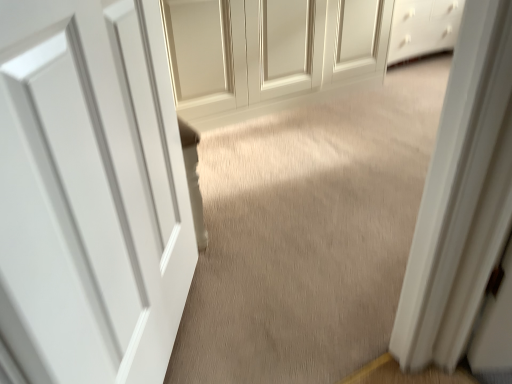
Question: Should I look upward or downward to see beige carpet at center?

Choices:
 (A) up
 (B) down

Answer: (A)

Question: From a real-world perspective, is white smooth door at center, acting as the 2th door starting from the right, below matte white door at center, the 1th door positioned from the top?

Choices:
 (A) yes
 (B) no

Answer: (B)

Question: Could you tell me if white smooth door at center, acting as the 1th door starting from the left, is turned towards matte white door at center, positioned as the 2th door in bottom-to-top order?

Choices:
 (A) yes
 (B) no

Answer: (B)

Question: Is white smooth door at center, which is the 1th door in front-to-back order, to the right of matte white door at center, positioned as the 2th door in bottom-to-top order, from the viewer's perspective?

Choices:
 (A) no
 (B) yes

Answer: (A)

Question: Does white smooth door at center, acting as the 1th door starting from the left, contain matte white door at center, which is the 2th door in left-to-right order?

Choices:
 (A) yes
 (B) no

Answer: (B)

Question: Is white smooth door at center, which appears as the second door when viewed from the top, directly adjacent to matte white door at center, which is counted as the 1th door, starting from the right?

Choices:
 (A) yes
 (B) no

Answer: (B)

Question: Considering the relative sizes of white smooth door at center, acting as the 2th door starting from the right, and matte white door at center, positioned as the 2th door in bottom-to-top order, in the image provided, is white smooth door at center, acting as the 2th door starting from the right, wider than matte white door at center, positioned as the 2th door in bottom-to-top order,?

Choices:
 (A) no
 (B) yes

Answer: (A)

Question: Considering the relative positions of matte white door at center, the second door viewed from the front, and white smooth door at center, acting as the 2th door starting from the right, in the image provided, is matte white door at center, the second door viewed from the front, to the left of white smooth door at center, acting as the 2th door starting from the right, from the viewer's perspective?

Choices:
 (A) yes
 (B) no

Answer: (B)

Question: From the image's perspective, is matte white door at center, which is the 2th door in left-to-right order, above white smooth door at center, which appears as the second door when viewed from the top?

Choices:
 (A) yes
 (B) no

Answer: (A)

Question: Can you confirm if matte white door at center, which is the 2th door in left-to-right order, is positioned to the right of white smooth door at center, acting as the 2th door starting from the right?

Choices:
 (A) yes
 (B) no

Answer: (A)

Question: Is the surface of matte white door at center, positioned as the 2th door in bottom-to-top order, in direct contact with white smooth door at center, the second door in the back-to-front sequence?

Choices:
 (A) yes
 (B) no

Answer: (B)

Question: Does matte white door at center, the second door viewed from the front, have a larger size compared to white smooth door at center, which is the 1th door in front-to-back order?

Choices:
 (A) yes
 (B) no

Answer: (A)

Question: From a real-world perspective, is matte white door at center, positioned as the 2th door in bottom-to-top order, beneath white smooth door at center, acting as the 1th door starting from the left?

Choices:
 (A) yes
 (B) no

Answer: (A)

Question: Does beige carpet at center appear on the right side of matte white door at center, the 1th door positioned from the top?

Choices:
 (A) yes
 (B) no

Answer: (A)